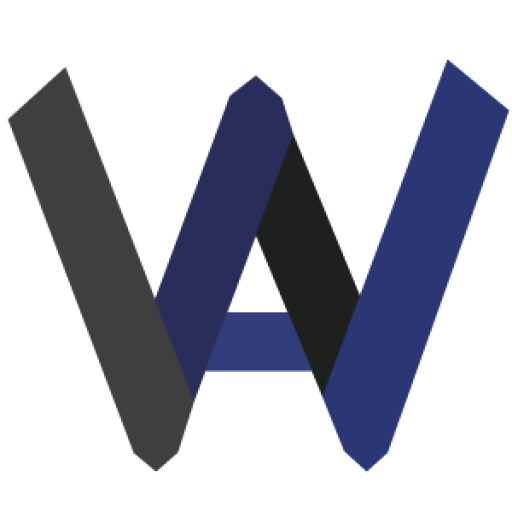
I want to click on angled bar, so click(x=100, y=236), click(x=214, y=226), click(x=297, y=240), click(x=414, y=234).